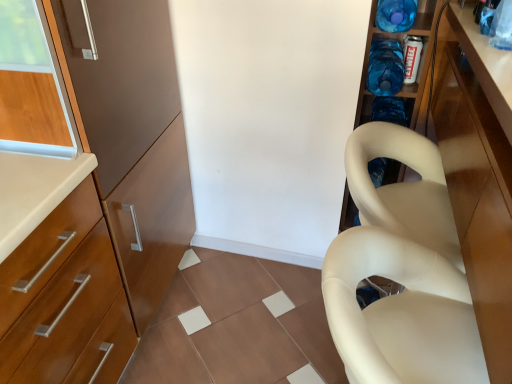
Question: From the image's perspective, is blue plastic bottle at upper right, which ranks as the first bottle in bottom-to-top order, below glossy wood cabinet at right?

Choices:
 (A) yes
 (B) no

Answer: (B)

Question: Is blue plastic bottle at upper right, which ranks as the first bottle in bottom-to-top order, not near glossy wood cabinet at right?

Choices:
 (A) yes
 (B) no

Answer: (B)

Question: Is the position of blue plastic bottle at upper right, the 2th bottle positioned from the top, less distant than that of glossy wood cabinet at right?

Choices:
 (A) yes
 (B) no

Answer: (B)

Question: Considering the relative positions of blue plastic bottle at upper right, which ranks as the first bottle in bottom-to-top order, and glossy wood cabinet at right in the image provided, is blue plastic bottle at upper right, which ranks as the first bottle in bottom-to-top order, to the left of glossy wood cabinet at right from the viewer's perspective?

Choices:
 (A) yes
 (B) no

Answer: (A)

Question: Does blue plastic bottle at upper right, which ranks as the first bottle in bottom-to-top order, have a greater width compared to glossy wood cabinet at right?

Choices:
 (A) yes
 (B) no

Answer: (B)

Question: From a real-world perspective, is beige matte plastic chair at right above or below glossy wood cabinet at right?

Choices:
 (A) below
 (B) above

Answer: (A)

Question: From the image's perspective, is beige matte plastic chair at right located above or below glossy wood cabinet at right?

Choices:
 (A) above
 (B) below

Answer: (B)

Question: Looking at their shapes, would you say beige matte plastic chair at right is wider or thinner than glossy wood cabinet at right?

Choices:
 (A) thin
 (B) wide

Answer: (A)

Question: Is beige matte plastic chair at right inside the boundaries of glossy wood cabinet at right, or outside?

Choices:
 (A) outside
 (B) inside

Answer: (B)

Question: From a real-world perspective, is beige matte plastic chair at right positioned above or below blue translucent bottle at upper right, the second bottle ordered from the bottom?

Choices:
 (A) above
 (B) below

Answer: (B)

Question: Which is correct: beige matte plastic chair at right is inside blue translucent bottle at upper right, the second bottle ordered from the bottom, or outside of it?

Choices:
 (A) inside
 (B) outside

Answer: (B)

Question: Is point (414, 352) positioned closer to the camera than point (409, 19)?

Choices:
 (A) farther
 (B) closer

Answer: (B)

Question: Considering the positions of beige matte plastic chair at right and blue translucent bottle at upper right, which is counted as the 1th bottle, starting from the top, in the image, is beige matte plastic chair at right bigger or smaller than blue translucent bottle at upper right, which is counted as the 1th bottle, starting from the top,?

Choices:
 (A) big
 (B) small

Answer: (A)

Question: In the image, is blue plastic bottle at upper right, the 2th bottle positioned from the top, on the left side or the right side of glossy wood cabinet at right?

Choices:
 (A) left
 (B) right

Answer: (A)

Question: From a real-world perspective, is blue plastic bottle at upper right, which ranks as the first bottle in bottom-to-top order, positioned above or below glossy wood cabinet at right?

Choices:
 (A) below
 (B) above

Answer: (B)